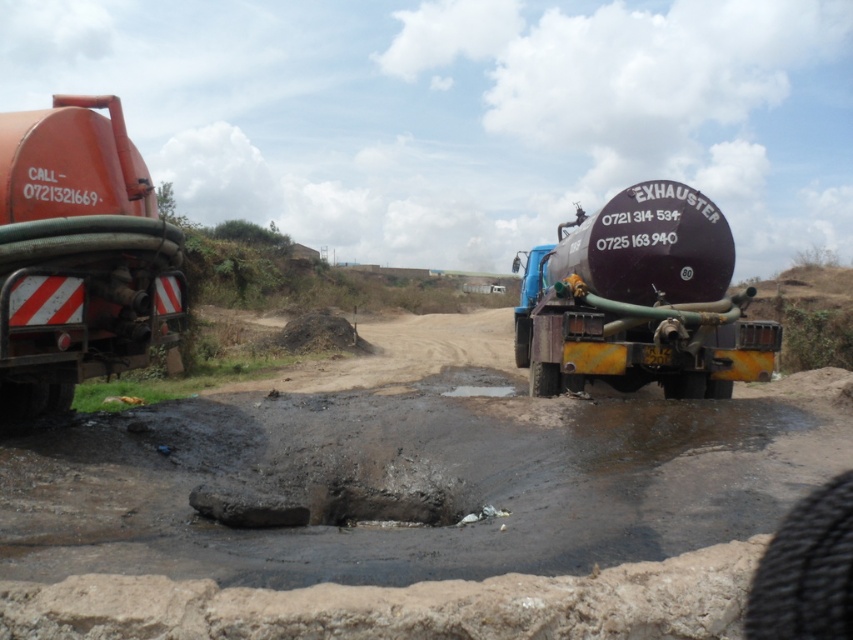
Which is in front, point (283, 612) or point (3, 307)?

Point (283, 612)

Looking at this image, can you confirm if smooth concrete at lower center is positioned above matte orange tank at left?

Actually, smooth concrete at lower center is below matte orange tank at left.

Image resolution: width=853 pixels, height=640 pixels. I want to click on smooth concrete at lower center, so click(402, 605).

Locate an element on the screen. The image size is (853, 640). smooth concrete at lower center is located at coordinates (402, 605).

Where is `matte orange tank at left`? The image size is (853, 640). matte orange tank at left is located at coordinates (77, 256).

Who is more distant from viewer, [50,160] or [700,262]?

The point [700,262] is behind.

Who is more forward, (1, 362) or (689, 264)?

Positioned in front is point (1, 362).

Where is `matte orange tank at left`? Image resolution: width=853 pixels, height=640 pixels. matte orange tank at left is located at coordinates (77, 256).

Is matte black tank at center bigger than black rubber puddle at center?

Correct, matte black tank at center is larger in size than black rubber puddle at center.

Does point (585, 326) come in front of point (462, 396)?

Yes, it is in front of point (462, 396).

Is point (697, 234) behind point (477, 396)?

Yes, it is.

Locate an element on the screen. The width and height of the screenshot is (853, 640). matte black tank at center is located at coordinates (641, 300).